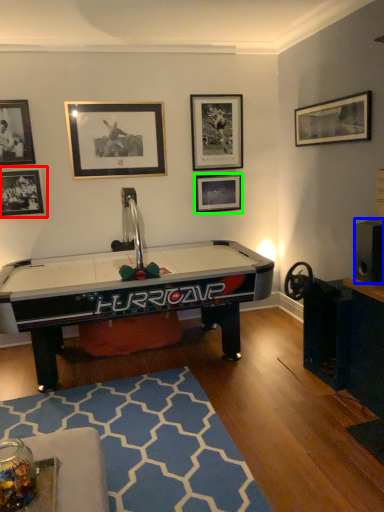
Question: Which object is the closest to the picture frame (highlighted by a red box)? Choose among these: speaker (highlighted by a blue box) or picture frame (highlighted by a green box).

Choices:
 (A) speaker
 (B) picture frame

Answer: (B)